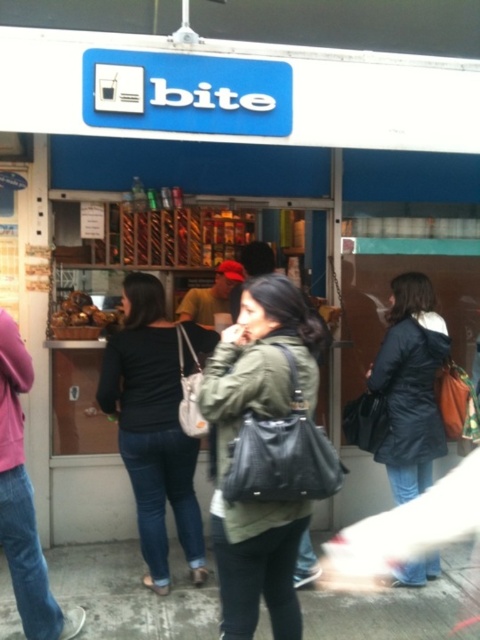
Identify the location of dark blue coat at center. This screenshot has height=640, width=480. (410, 385).

At what (x,y) coordinates should I click in order to perform the action: click on dark blue coat at center. Please return your answer as a coordinate pair (x, y). The height and width of the screenshot is (640, 480). Looking at the image, I should click on (410, 385).

Is matte black bag at center wider than denim jeans at left?

Yes.

Can you confirm if matte black bag at center is smaller than denim jeans at left?

Actually, matte black bag at center might be larger than denim jeans at left.

Which is in front, point (316, 365) or point (26, 564)?

Point (316, 365)

The width and height of the screenshot is (480, 640). Identify the location of matte black bag at center. (236, 435).

Is point (230, 611) more distant than point (422, 488)?

No, it is not.

Can you confirm if matte black bag at center is positioned above dark blue coat at center?

No, matte black bag at center is not above dark blue coat at center.

Who is more distant from viewer, (206,413) or (384,378)?

Point (384,378)

At what (x,y) coordinates should I click in order to perform the action: click on matte black bag at center. Please return your answer as a coordinate pair (x, y). Looking at the image, I should click on (236, 435).